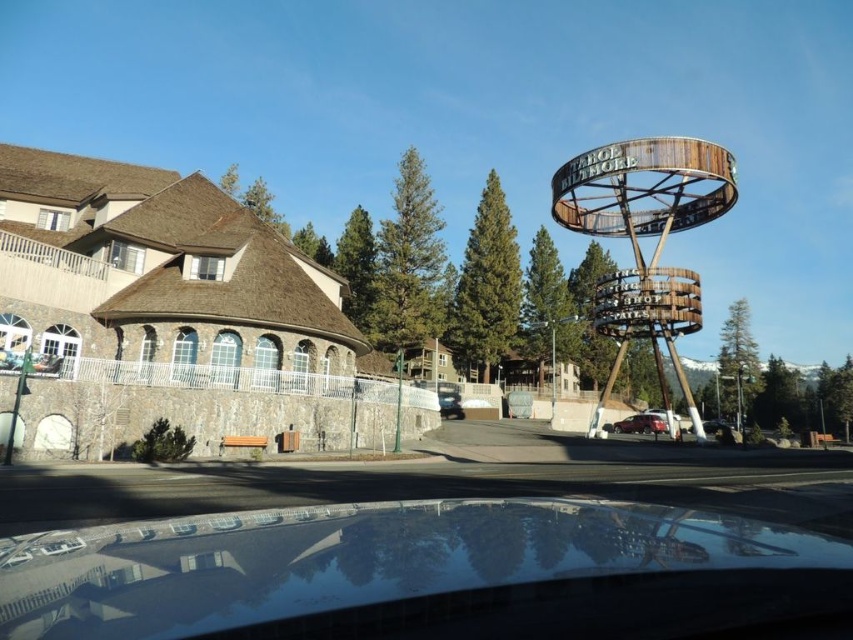
You are standing at the base of the Biltmore structure and want to reach the point marked at coordinates [643,413]. The path you need to take is 305.84 meters long. If you walk at a speed of 1.5 meters per second, how many minutes will it take you to reach the point?

The distance to the point marked at coordinates [643,413] is 305.84 meters. Walking at 1.5 meters per second, it will take 305.84 divided by 1.5 equals approximately 203.89 seconds. Converting seconds to minutes, divide by 60, resulting in approximately 3.4 minutes. So, it will take about 3.4 minutes to reach the point.

You are standing in front of the metallic silver car at center and want to read the rustic wood sign at upper right. Can you see the entire sign without moving your head?

The rustic wood sign at upper right might be wider than metallic silver car at center, so there is a chance that part of the sign could be obstructed by the car or other objects. However, since the car is at the center and the sign is at the upper right, you might still be able to see most of it by looking upward and to the right. But without knowing the exact width comparison, it is uncertain if the entire sign is visible.